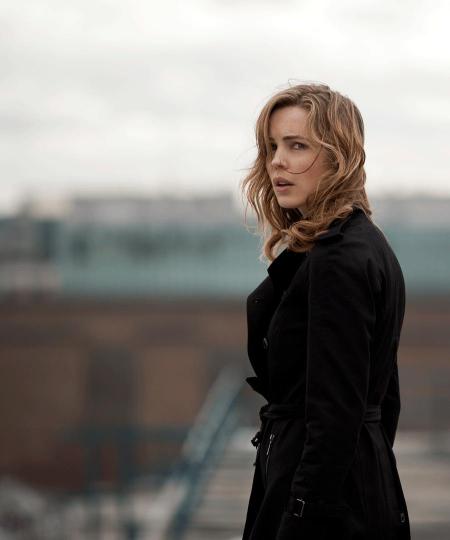
The width and height of the screenshot is (450, 540). I want to click on stairs, so click(226, 483), click(432, 462).